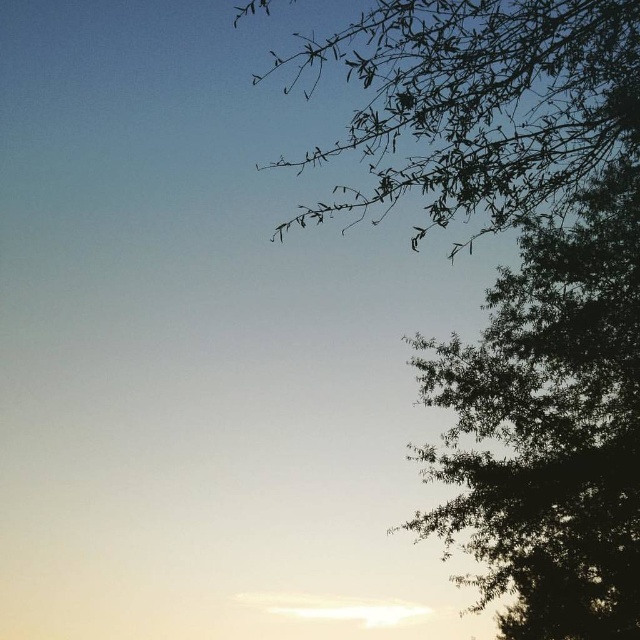
You are an artist trying to paint this scene. You notice the green leafy tree at upper right and the silhouette branches at upper right. Which object should you paint first if you want to follow the rule of painting larger objects before smaller ones?

The green leafy tree at upper right should be painted first because it is bigger than the silhouette branches at upper right according to the description.

You are standing in the middle of the scene and want to walk towards the point at coordinates point (500,138) and point (513,316). Which point will you reach first?

You will reach point (500,138) first because it is in front of point (513,316).